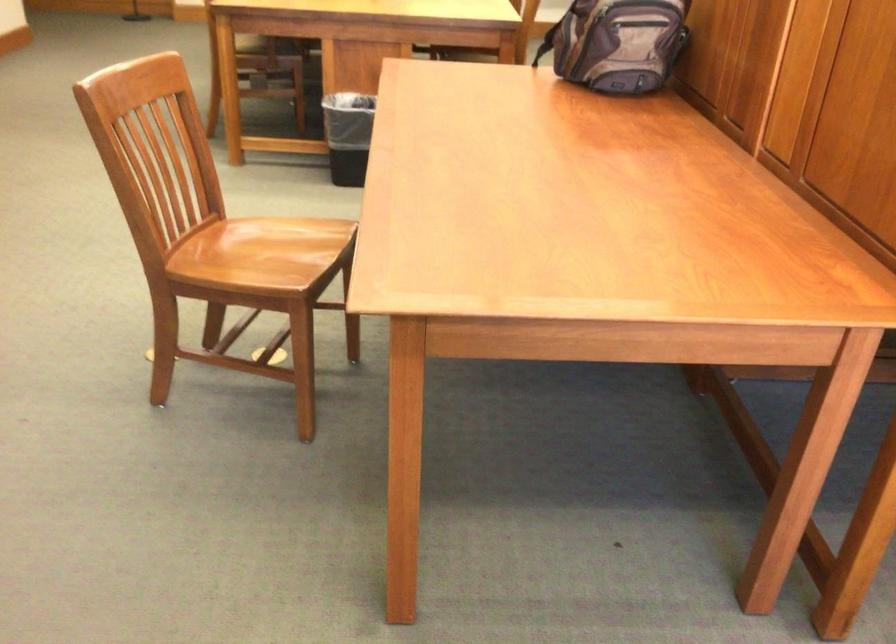
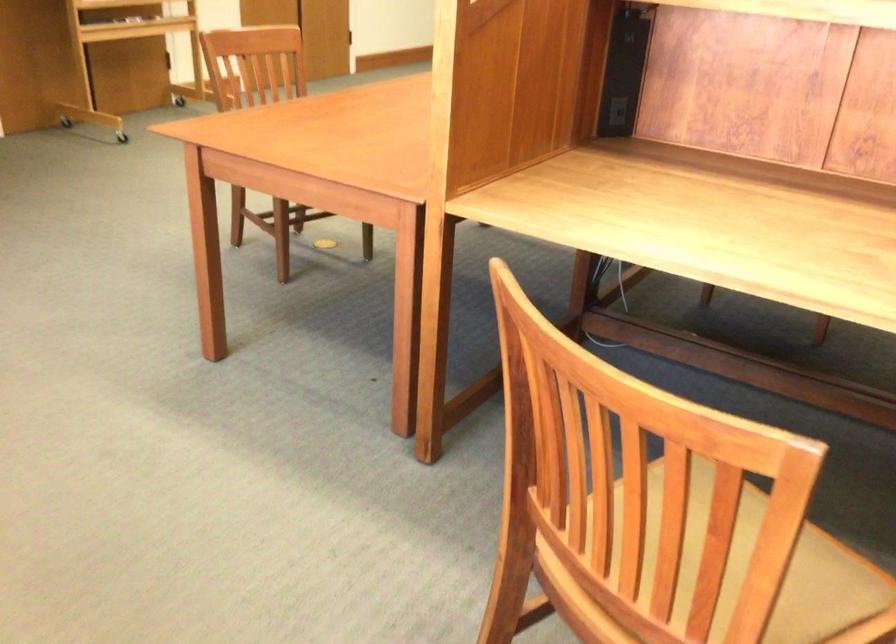
Find the pixel in the second image that matches the point at 810,122 in the first image.

(616, 111)